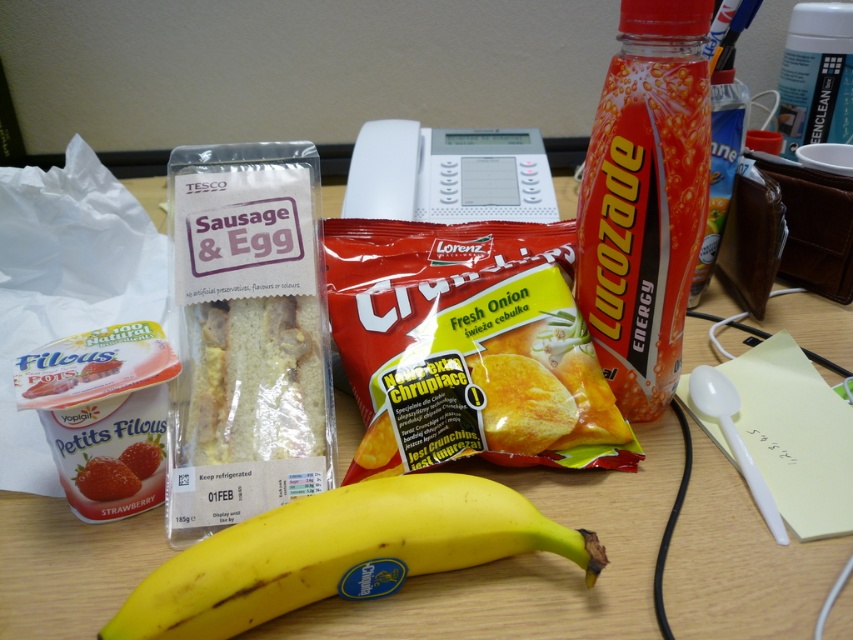
Does yellow crunchy chips at center have a greater height compared to orange glossy lucozade energy drink at upper right?

In fact, yellow crunchy chips at center may be shorter than orange glossy lucozade energy drink at upper right.

Is point (566, 316) closer to camera compared to point (708, 90)?

No, (566, 316) is behind (708, 90).

Image resolution: width=853 pixels, height=640 pixels. What are the coordinates of `yellow crunchy chips at center` in the screenshot? It's located at (468, 346).

Is point (462, 353) farther from viewer compared to point (286, 596)?

Yes, point (462, 353) is behind point (286, 596).

Measure the distance between point (598,452) and camera.

Point (598,452) is 48.53 centimeters away from camera.

Identify the location of yellow crunchy chips at center. This screenshot has height=640, width=853. (468, 346).

Does yellow matte banana at center have a greater height compared to orange glossy lucozade energy drink at upper right?

No, yellow matte banana at center is not taller than orange glossy lucozade energy drink at upper right.

Does yellow matte banana at center appear on the right side of orange glossy lucozade energy drink at upper right?

Incorrect, yellow matte banana at center is not on the right side of orange glossy lucozade energy drink at upper right.

Is point (454, 502) farther from viewer compared to point (647, 344)?

No, (454, 502) is in front of (647, 344).

Identify the location of yellow matte banana at center. The image size is (853, 640). (341, 552).